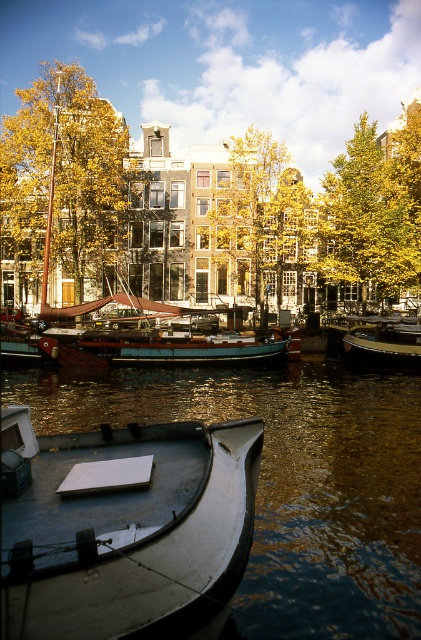
Can you confirm if yellow/golden wood tree at upper left is smaller than yellow/golden leaves at upper center?

No.

Which is above, yellow/golden wood tree at upper left or yellow/golden leaves at upper center?

Positioned higher is yellow/golden leaves at upper center.

Is point (56, 243) in front of point (386, 221)?

No, (56, 243) is further to viewer.

The height and width of the screenshot is (640, 421). I want to click on yellow/golden wood tree at upper left, so click(63, 177).

Who is shorter, yellow/golden wood tree at upper left or white matte dock at center?

With less height is white matte dock at center.

Which is above, yellow/golden wood tree at upper left or white matte dock at center?

Positioned higher is yellow/golden wood tree at upper left.

You are a GUI agent. You are given a task and a screenshot of the screen. Output one action in this format:
    pyautogui.click(x=<x>, y=<y>)
    Task: Click on the yellow/golden wood tree at upper left
    This screenshot has width=421, height=640.
    Given the screenshot: What is the action you would take?
    pyautogui.click(x=63, y=177)

Is yellow/golden leaves at upper center positioned behind yellow/golden leaves at center?

Yes, yellow/golden leaves at upper center is further from the viewer.

Consider the image. Does yellow/golden leaves at upper center have a smaller size compared to yellow/golden leaves at center?

Actually, yellow/golden leaves at upper center might be larger than yellow/golden leaves at center.

Who is more distant from viewer, (394, 234) or (284, 246)?

The point (284, 246) is more distant.

I want to click on yellow/golden leaves at upper center, so click(x=373, y=211).